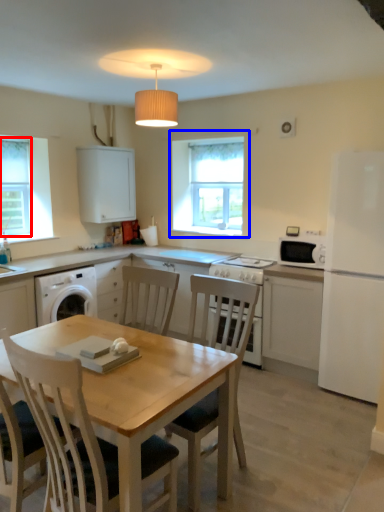
Question: Which object is closer to the camera taking this photo, window screen (highlighted by a red box) or window (highlighted by a blue box)?

Choices:
 (A) window screen
 (B) window

Answer: (A)